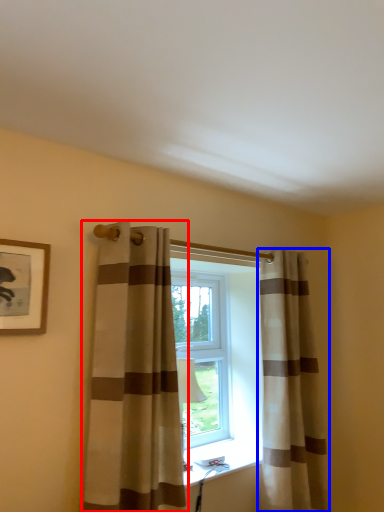
Question: Which of the following is the closest to the observer, curtain (highlighted by a red box) or curtain (highlighted by a blue box)?

Choices:
 (A) curtain
 (B) curtain

Answer: (A)